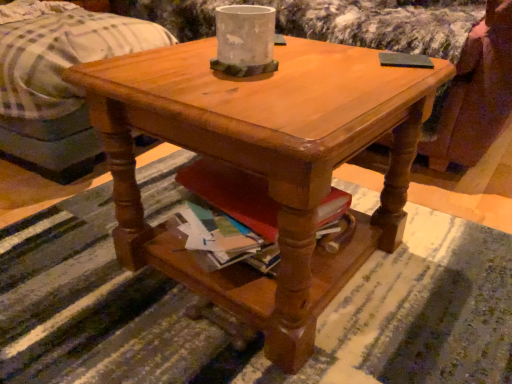
Question: From a real-world perspective, is white concrete vase at center above or below matte wood coffee table at center?

Choices:
 (A) above
 (B) below

Answer: (A)

Question: Visually, is white concrete vase at center positioned to the left or to the right of matte wood coffee table at center?

Choices:
 (A) left
 (B) right

Answer: (A)

Question: Based on their relative distances, which object is farther from the matte wood coffee table at center?

Choices:
 (A) white cotton bed at upper left
 (B) white concrete vase at center

Answer: (A)

Question: Which is nearer to the matte wood coffee table at center?

Choices:
 (A) white concrete vase at center
 (B) white cotton bed at upper left

Answer: (A)